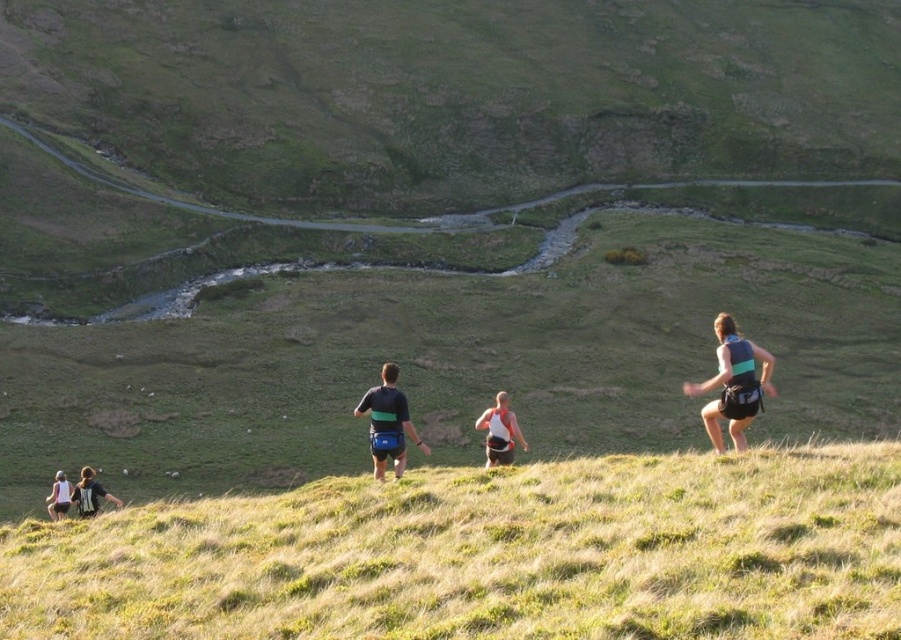
Question: Which of the following is the closest to the observer?

Choices:
 (A) white fabric tank top at center
 (B) green fabric vest at right

Answer: (B)

Question: Which object appears closest to the camera in this image?

Choices:
 (A) white fabric tank top at center
 (B) white fabric tank top at lower left
 (C) matte black backpack at lower left

Answer: (A)

Question: Is matte black backpack at lower left bigger than white fabric tank top at lower left?

Choices:
 (A) no
 (B) yes

Answer: (B)

Question: Considering the relative positions of green grassy hillside at center and white fabric tank top at center in the image provided, where is green grassy hillside at center located with respect to white fabric tank top at center?

Choices:
 (A) below
 (B) above

Answer: (A)

Question: Estimate the real-world distances between objects in this image. Which object is closer to the green grassy hillside at center?

Choices:
 (A) white fabric tank top at lower left
 (B) dark blue fabric shorts at center
 (C) white fabric tank top at center

Answer: (B)

Question: Does dark blue fabric shorts at center have a greater width compared to matte black backpack at lower left?

Choices:
 (A) yes
 (B) no

Answer: (B)